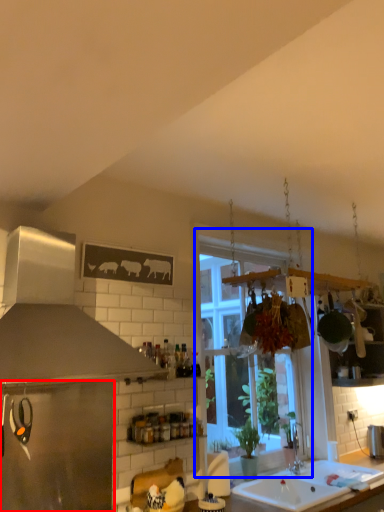
Question: Which of the following is the closest to the observer, appliance (highlighted by a red box) or window (highlighted by a blue box)?

Choices:
 (A) appliance
 (B) window

Answer: (A)